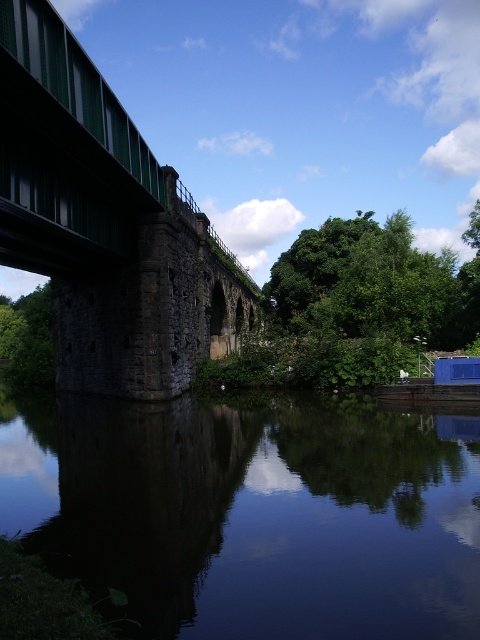
Question: Which of these objects is positioned closest to the dark reflective water at lower center?

Choices:
 (A) green leafy tree at lower left
 (B) green leafy tree at center

Answer: (B)

Question: Does green metallic bridge at left appear under green leafy tree at lower left?

Choices:
 (A) yes
 (B) no

Answer: (A)

Question: Which of the following is the farthest from the observer?

Choices:
 (A) (82, 72)
 (B) (16, 326)
 (C) (250, 500)

Answer: (B)

Question: Does dark reflective water at lower center appear on the left side of green leafy tree at center?

Choices:
 (A) no
 (B) yes

Answer: (B)

Question: Does green metallic bridge at left come in front of green leafy tree at center?

Choices:
 (A) yes
 (B) no

Answer: (A)

Question: Which point is farther to the camera?

Choices:
 (A) (70, 96)
 (B) (165, 442)
 (C) (48, 355)

Answer: (C)